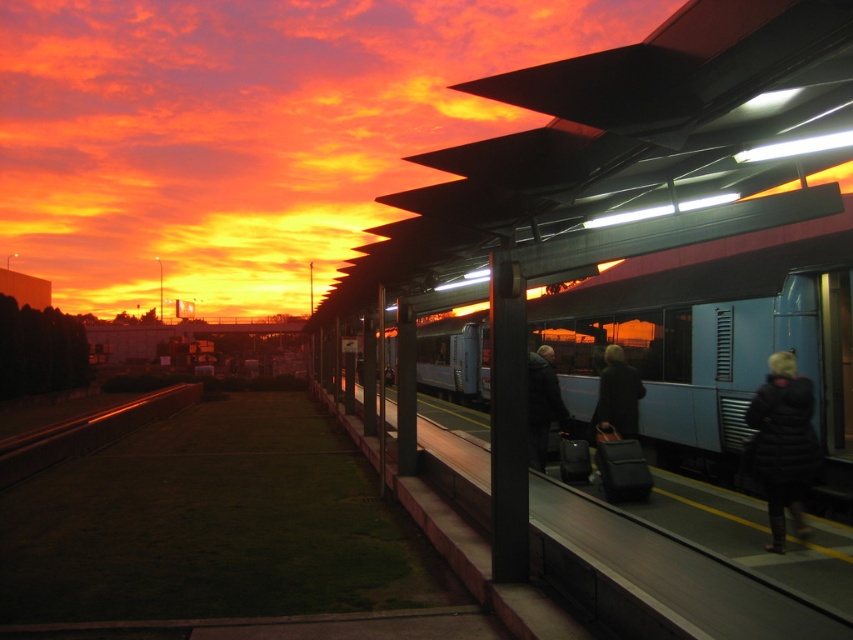
Looking at this image, is dark gray jacket at center below dark gray coat at center?

Indeed, dark gray jacket at center is positioned under dark gray coat at center.

Does dark gray jacket at center have a greater width compared to dark gray coat at center?

No.

Who is more distant from viewer, (537, 388) or (633, 374)?

The point (633, 374) is behind.

Identify the location of dark gray jacket at center. The height and width of the screenshot is (640, 853). (543, 403).

Can you confirm if black puffy coat at lower right is smaller than black metal train track at lower left?

Yes, black puffy coat at lower right is smaller than black metal train track at lower left.

Which is behind, point (805, 385) or point (138, 426)?

The point (138, 426) is behind.

Is point (811, 406) farther from viewer compared to point (61, 444)?

No, it is not.

The width and height of the screenshot is (853, 640). Identify the location of black puffy coat at lower right. (782, 444).

Does blue metallic train at center come behind dark gray coat at center?

No, blue metallic train at center is closer to the viewer.

Is point (850, 353) positioned before point (634, 388)?

No, it is not.

This screenshot has height=640, width=853. I want to click on blue metallic train at center, so click(714, 362).